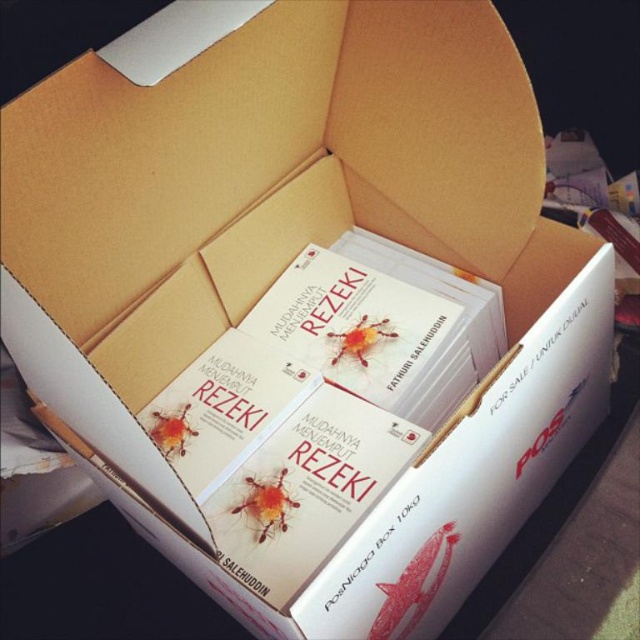
Is white matte book at center closer to camera compared to matte white book at center?

Yes.

Does point (412, 435) come in front of point (445, 401)?

Yes, it is.

Identify the location of white matte book at center. The image size is (640, 640). (323, 400).

Image resolution: width=640 pixels, height=640 pixels. Find the location of `white matte book at center`. white matte book at center is located at coordinates (323, 400).